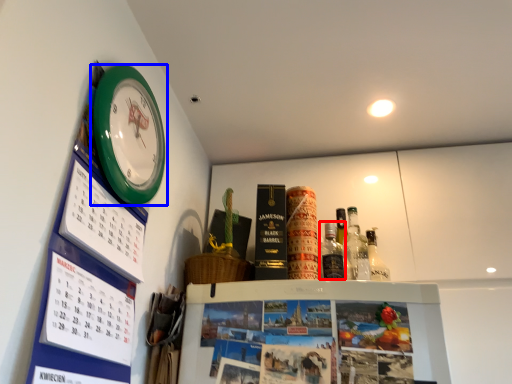
Question: Which object appears closest to the camera in this image, bottle (highlighted by a red box) or wall clock (highlighted by a blue box)?

Choices:
 (A) bottle
 (B) wall clock

Answer: (B)